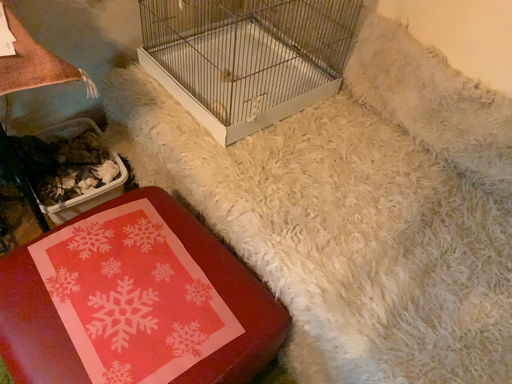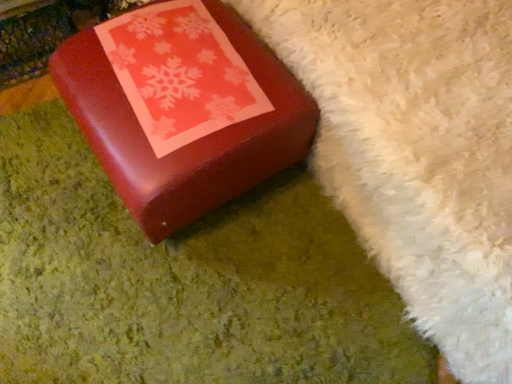
Question: How did the camera likely rotate when shooting the video?

Choices:
 (A) rotated left
 (B) rotated right

Answer: (A)